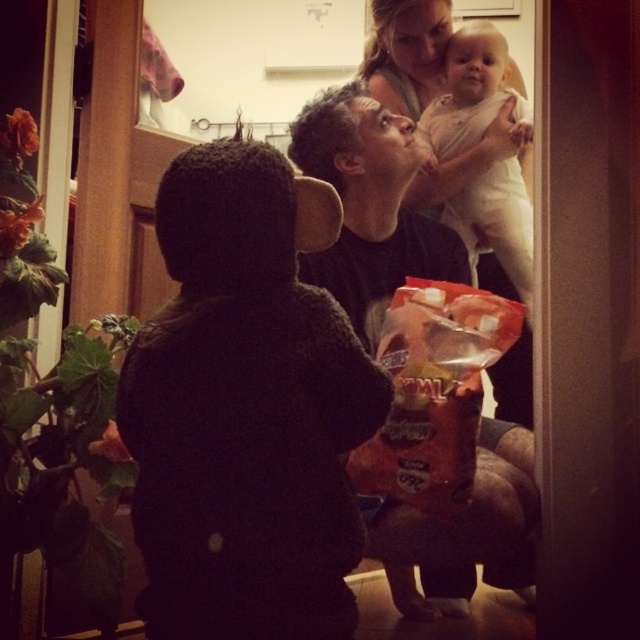
Between matte black shirt at center and white cloth baby at upper center, which one is positioned lower?

Positioned lower is matte black shirt at center.

From the picture: Who is positioned more to the right, matte black shirt at center or white cloth baby at upper center?

From the viewer's perspective, white cloth baby at upper center appears more on the right side.

Which is in front, point (364, 323) or point (525, 134)?

Positioned in front is point (364, 323).

The height and width of the screenshot is (640, 640). In order to click on matte black shirt at center in this screenshot , I will do `click(369, 205)`.